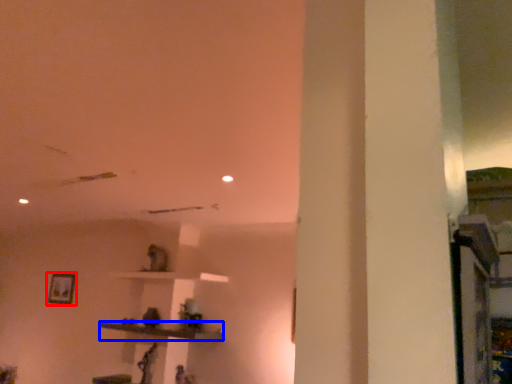
Question: Which object is closer to the camera taking this photo, picture frame (highlighted by a red box) or furniture (highlighted by a blue box)?

Choices:
 (A) picture frame
 (B) furniture

Answer: (B)